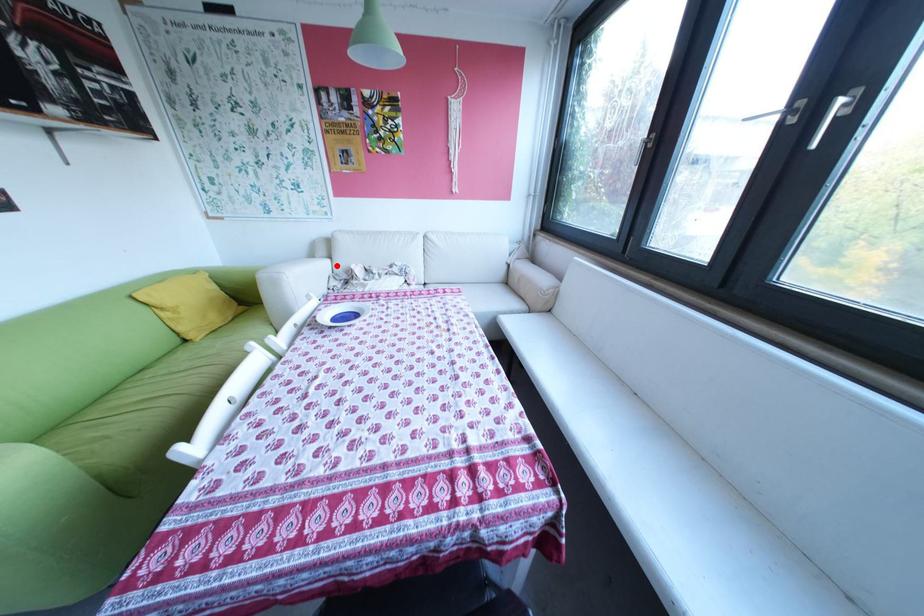
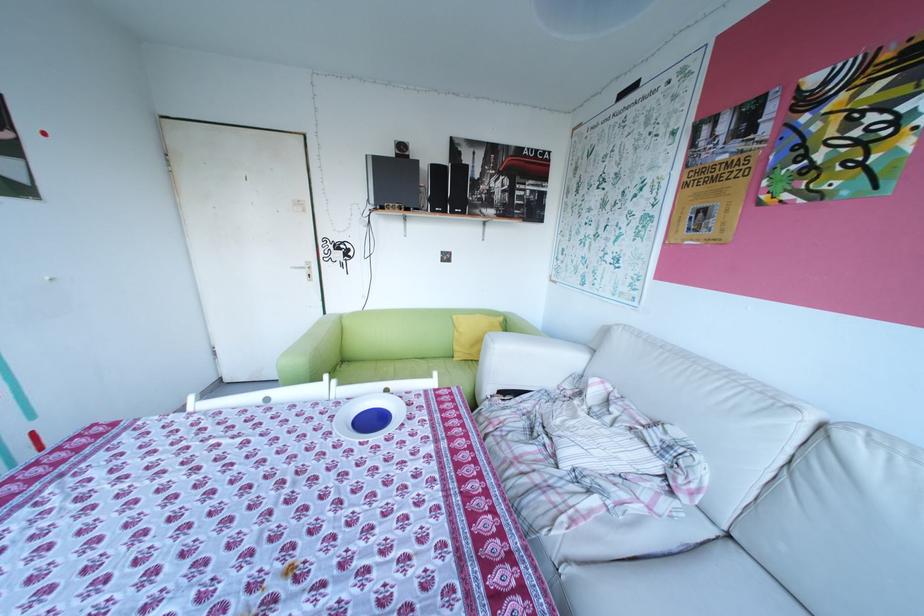
Question: I am providing you with two images of the same scene from different viewpoints. A red point is shown in image1. For the corresponding object point in image2, is it positioned nearer or farther from the camera?

Choices:
 (A) Nearer
 (B) Farther

Answer: (A)